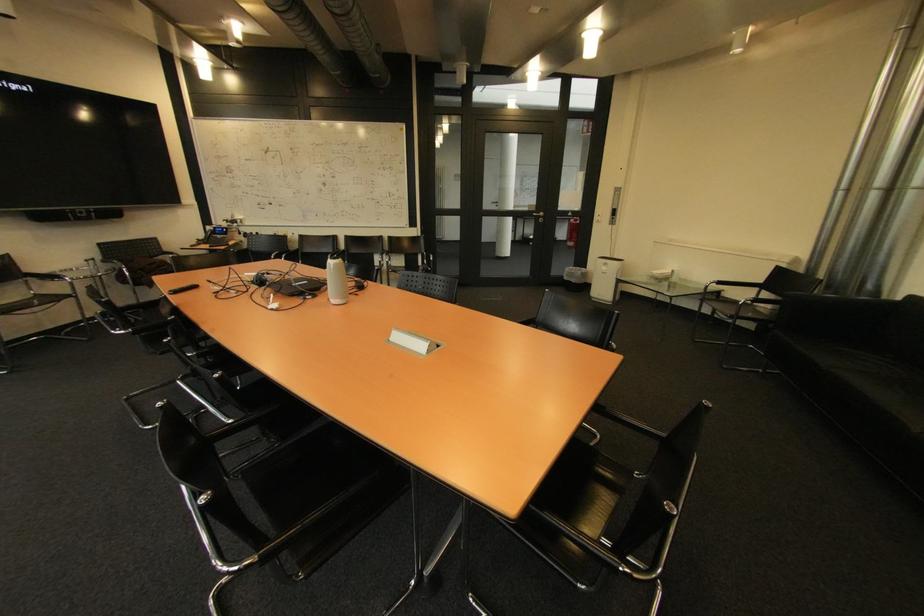
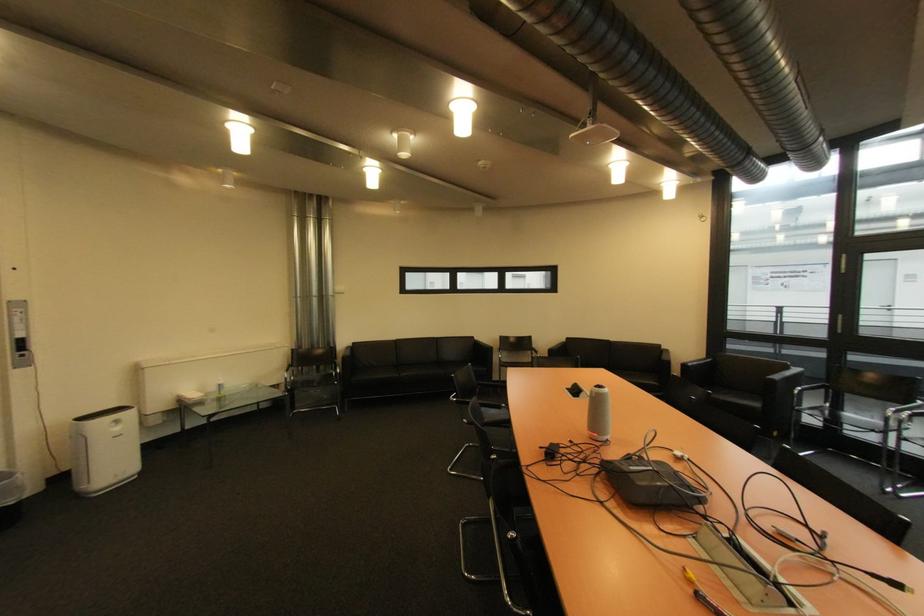
Find the pixel in the second image that matches pixel 622 220 in the first image.

(30, 357)